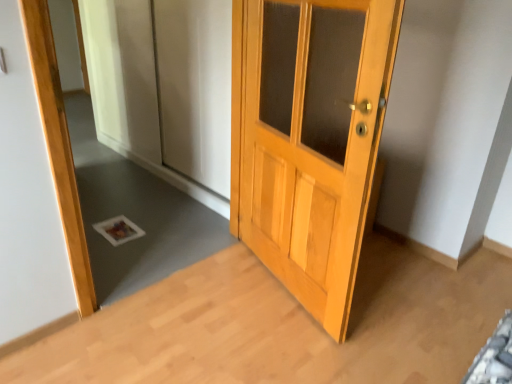
The width and height of the screenshot is (512, 384). What are the coordinates of `vacant area in front of light brown wooden door at center` in the screenshot? It's located at (279, 335).